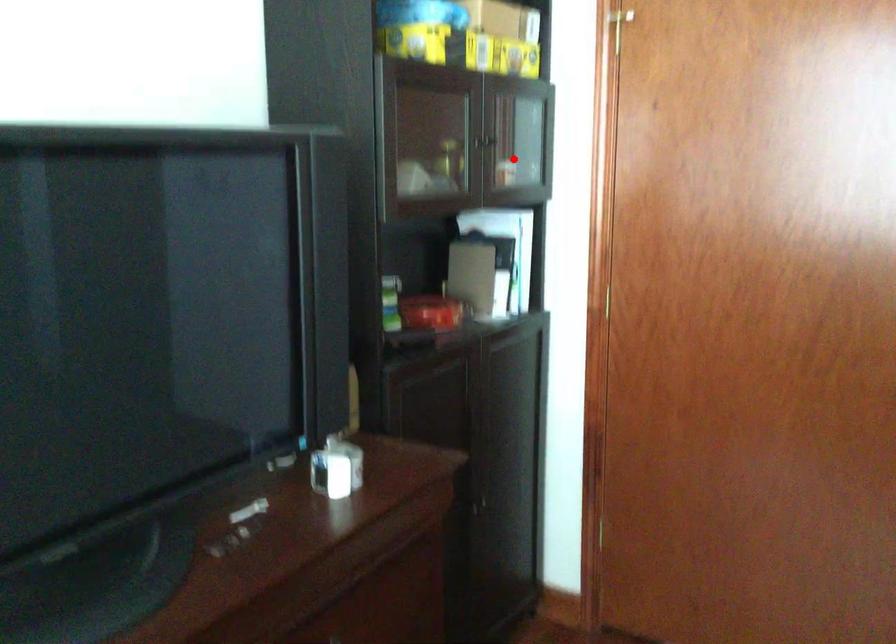
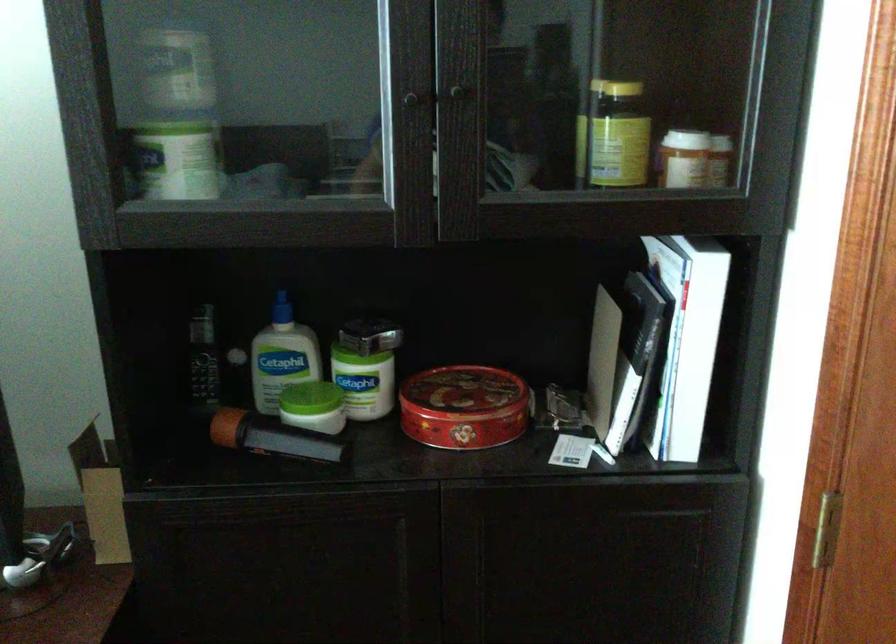
Question: I am providing you with two images of the same scene from different viewpoints. A red point is shown in image1. For the corresponding object point in image2, is it positioned nearer or farther from the camera?

Choices:
 (A) Nearer
 (B) Farther

Answer: (A)